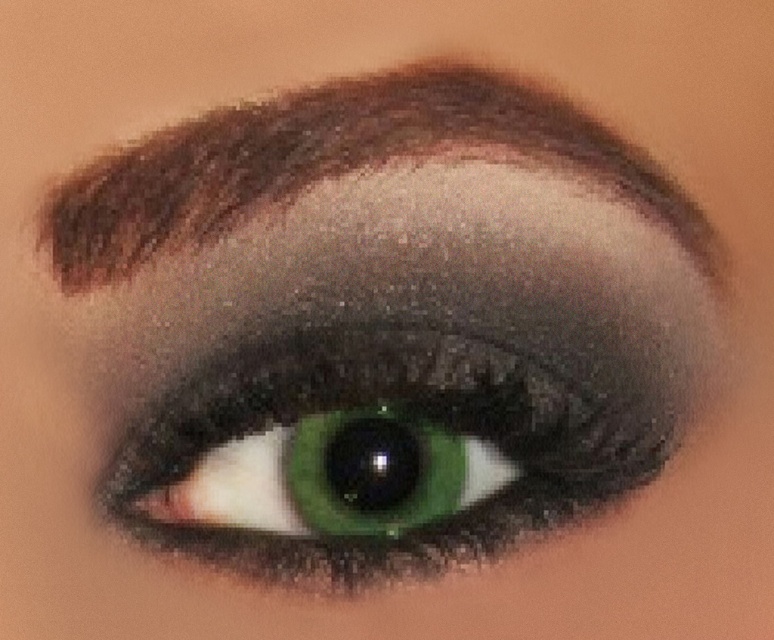
Question: Is shiny green eye at center positioned before smokey brown eyebrow at upper center?

Choices:
 (A) no
 (B) yes

Answer: (A)

Question: Which of the following is the closest to the observer?

Choices:
 (A) shiny green eye at center
 (B) smokey brown eyebrow at upper center

Answer: (B)

Question: Does shiny green eye at center lie in front of smokey brown eyebrow at upper center?

Choices:
 (A) yes
 (B) no

Answer: (B)

Question: Does shiny green eye at center appear over smokey brown eyebrow at upper center?

Choices:
 (A) yes
 (B) no

Answer: (B)